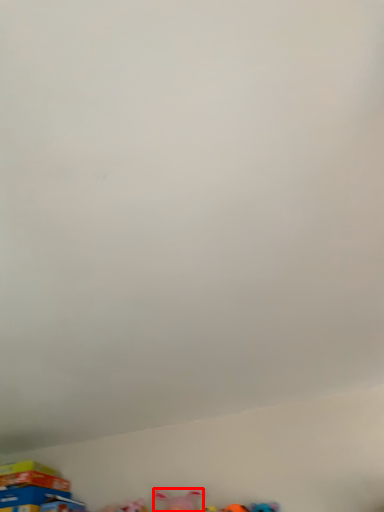
Question: From the image's perspective, what is the correct spatial positioning of toy (annotated by the red box) in reference to toy?

Choices:
 (A) above
 (B) below

Answer: (A)